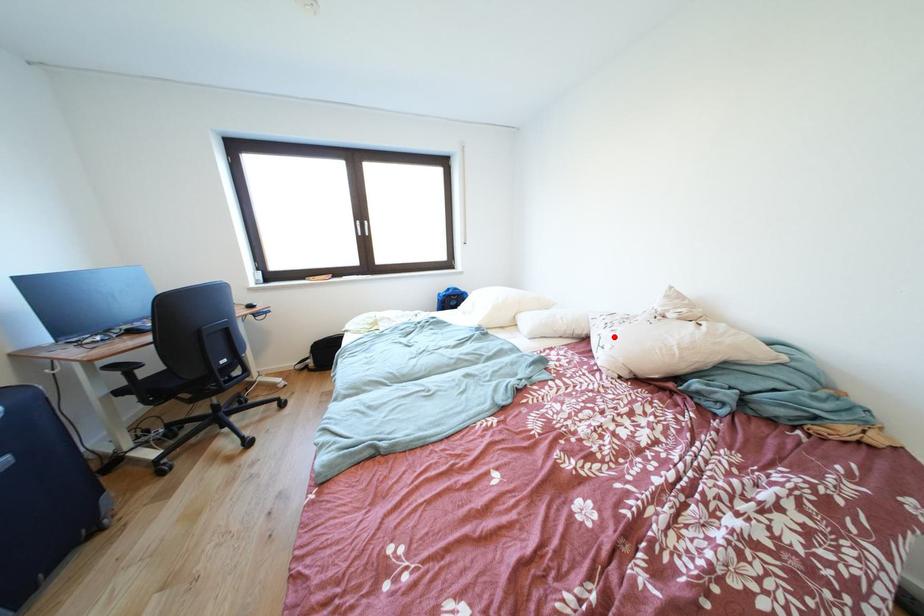
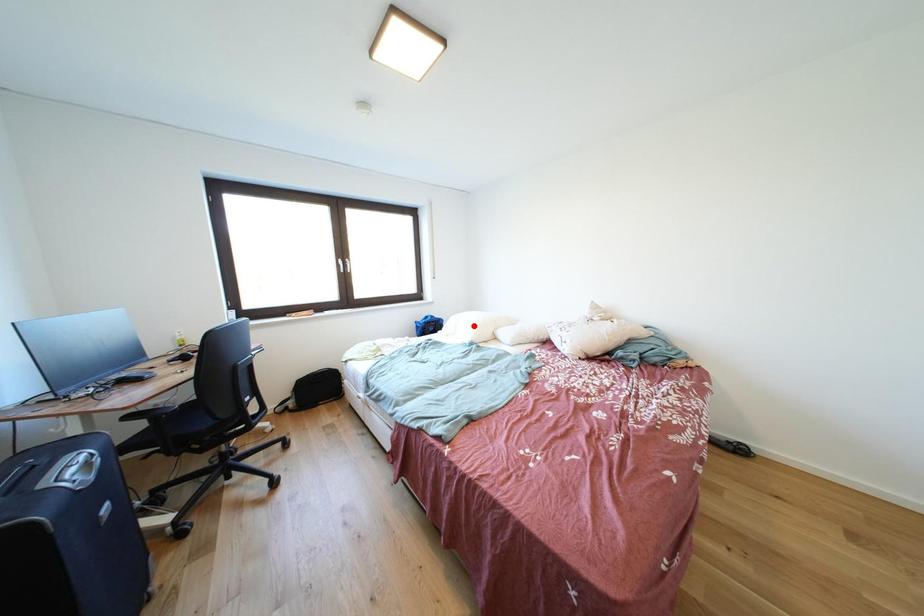
I am providing you with two images of the same scene from different viewpoints. A red point is marked on the first image and another point is marked on the second image. Is the red point in image1 aligned with the point shown in image2?

No